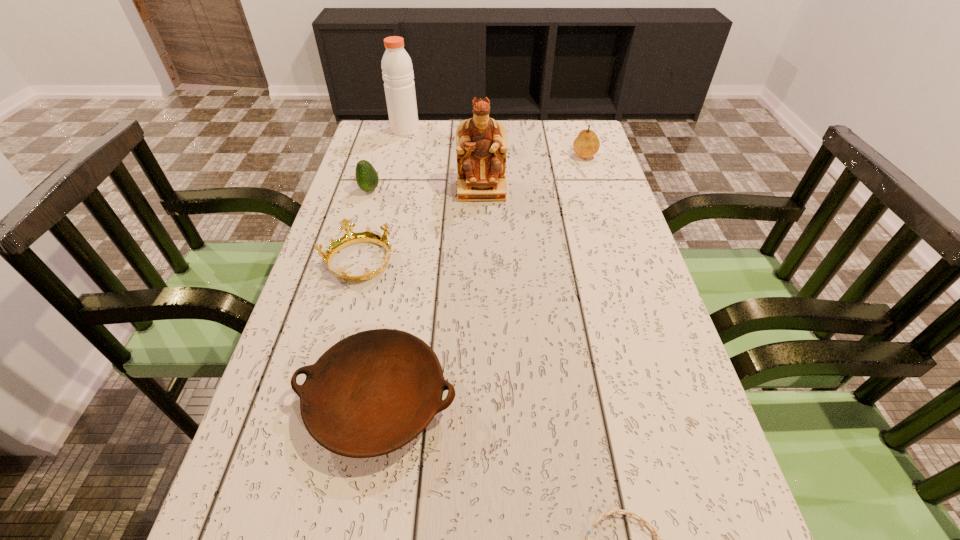
The height and width of the screenshot is (540, 960). I want to click on free spot between the figurine and the second nearest object, so click(x=429, y=295).

Image resolution: width=960 pixels, height=540 pixels. What are the coordinates of `object that ranks as the third closest to the figurine` in the screenshot? It's located at (586, 145).

At what (x,y) coordinates should I click in order to perform the action: click on object that stands as the second closest to the shortest object. Please return your answer as a coordinate pair (x, y). Looking at the image, I should click on (349, 238).

You are a GUI agent. You are given a task and a screenshot of the screen. Output one action in this format:
    pyautogui.click(x=<x>, y=<y>)
    Task: Click on the vacant space that satisfies the following two spatial constraints: 1. on the front side of the pear; 2. on the left side of the shaker
    Image resolution: width=960 pixels, height=540 pixels.
    Given the screenshot: What is the action you would take?
    pyautogui.click(x=399, y=154)

You are a GUI agent. You are given a task and a screenshot of the screen. Output one action in this format:
    pyautogui.click(x=<x>, y=<y>)
    Task: Click on the free spot that satisfies the following two spatial constraints: 1. on the back side of the shaker; 2. on the left side of the crown
    This screenshot has height=540, width=960.
    Given the screenshot: What is the action you would take?
    pyautogui.click(x=395, y=130)